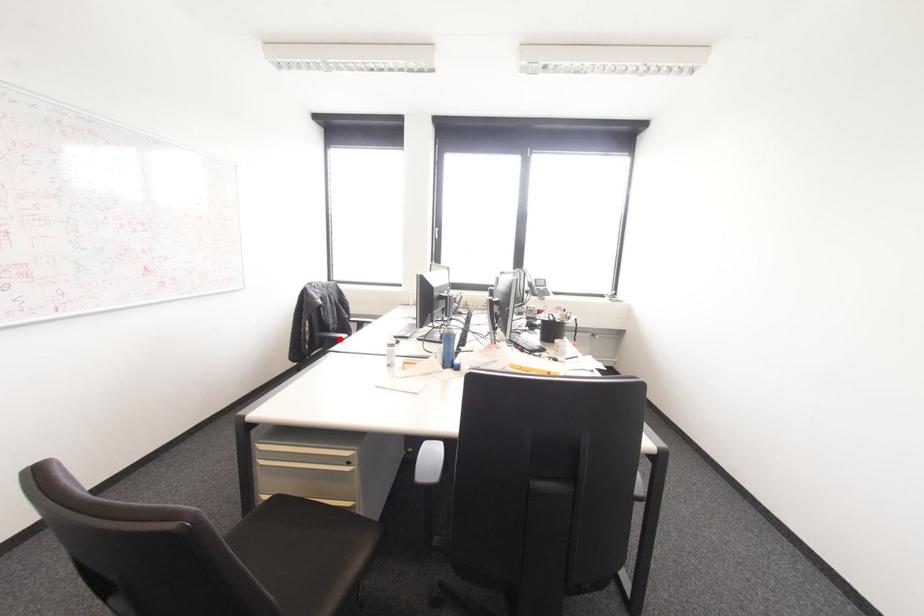
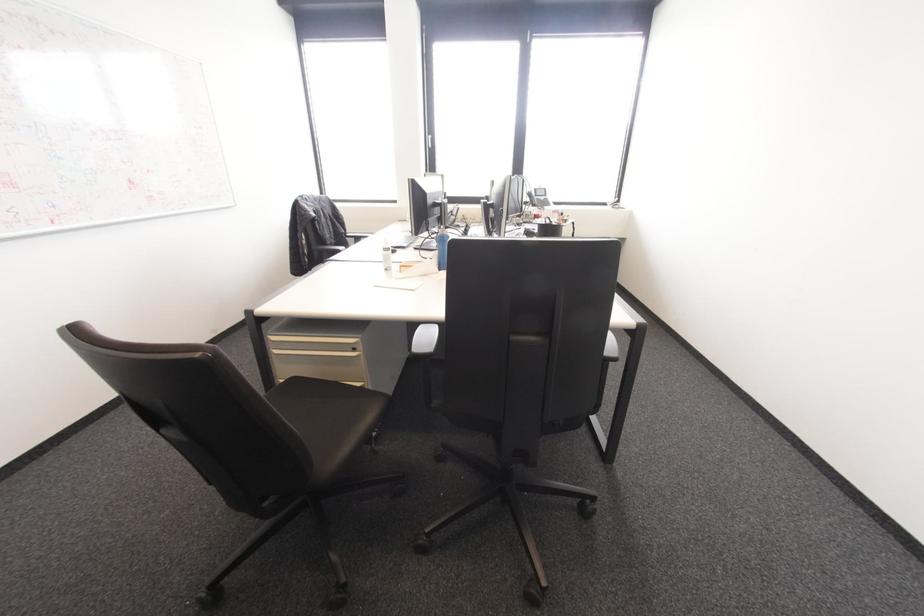
Where in the second image is the point corresponding to the highlighted location from the first image?

(337, 251)